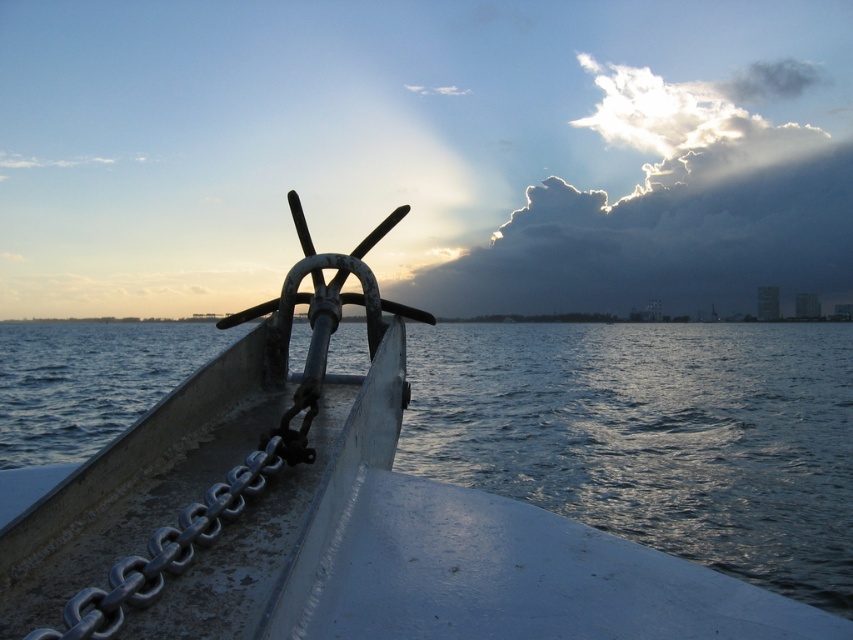
Who is lower down, metallic chain anchor at center or cloudy sky at upper center?

metallic chain anchor at center

Is metallic chain anchor at center to the right of cloudy sky at upper center from the viewer's perspective?

In fact, metallic chain anchor at center is to the left of cloudy sky at upper center.

Is point (329, 426) in front of point (577, 289)?

That is True.

This screenshot has width=853, height=640. Find the location of `metallic chain anchor at center`. metallic chain anchor at center is located at coordinates (349, 513).